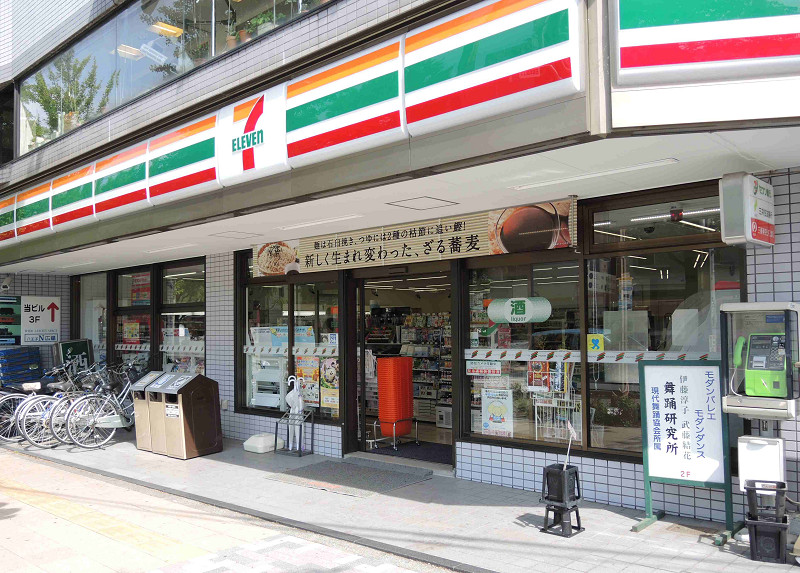
Locate an element on the screen. rubbish bin is located at coordinates (154, 423).